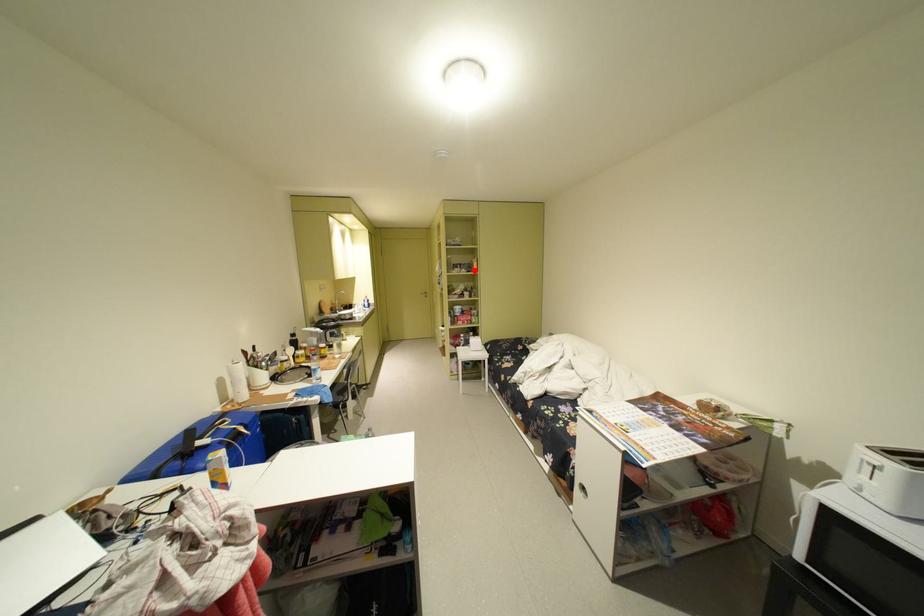
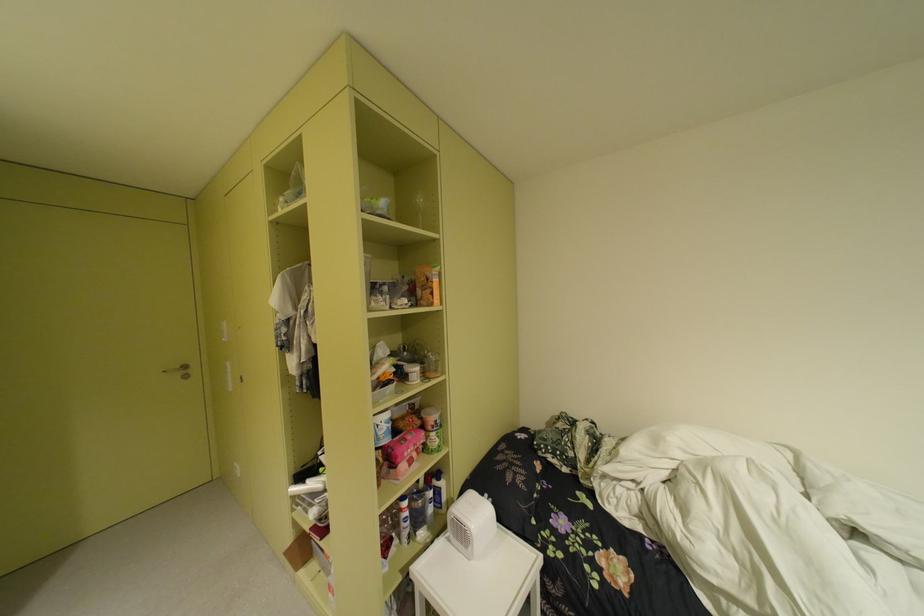
Where in the second image is the point corresponding to the highlighted location from the first image?

(417, 301)